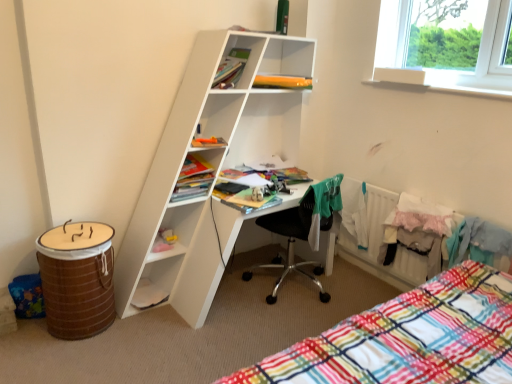
Question: Should I look upward or downward to see matte yellow book at center, which appears as the 2th book when ordered from the bottom?

Choices:
 (A) down
 (B) up

Answer: (B)

Question: Is orange plastic bag at upper center, which ranks as the 4th book in bottom-to-top order, oriented towards brown woven barrel at lower left?

Choices:
 (A) no
 (B) yes

Answer: (A)

Question: Is orange plastic bag at upper center, which ranks as the 4th book in bottom-to-top order, closer to the viewer compared to brown woven barrel at lower left?

Choices:
 (A) yes
 (B) no

Answer: (B)

Question: From a real-world perspective, does orange plastic bag at upper center, which ranks as the 4th book in bottom-to-top order, stand above brown woven barrel at lower left?

Choices:
 (A) yes
 (B) no

Answer: (A)

Question: Does orange plastic bag at upper center, arranged as the second book when viewed from the top, have a lesser height compared to brown woven barrel at lower left?

Choices:
 (A) yes
 (B) no

Answer: (A)

Question: Is orange plastic bag at upper center, arranged as the second book when viewed from the top, at the right side of brown woven barrel at lower left?

Choices:
 (A) no
 (B) yes

Answer: (B)

Question: Is orange plastic bag at upper center, arranged as the second book when viewed from the top, not within brown woven barrel at lower left?

Choices:
 (A) yes
 (B) no

Answer: (A)

Question: Can you confirm if white matte desk at center is thinner than matte yellow book at center, arranged as the fourth book when viewed from the top?

Choices:
 (A) no
 (B) yes

Answer: (A)

Question: Is white matte desk at center to the right of matte yellow book at center, arranged as the fourth book when viewed from the top, from the viewer's perspective?

Choices:
 (A) no
 (B) yes

Answer: (B)

Question: Is white matte desk at center oriented away from matte yellow book at center, which appears as the 2th book when ordered from the bottom?

Choices:
 (A) no
 (B) yes

Answer: (B)

Question: Is white matte desk at center to the left of matte yellow book at center, arranged as the fourth book when viewed from the top, from the viewer's perspective?

Choices:
 (A) yes
 (B) no

Answer: (B)

Question: Can you confirm if white matte desk at center is bigger than matte yellow book at center, which appears as the 2th book when ordered from the bottom?

Choices:
 (A) no
 (B) yes

Answer: (B)

Question: Is matte yellow book at center, arranged as the fourth book when viewed from the top, completely or partially inside white matte desk at center?

Choices:
 (A) yes
 (B) no

Answer: (A)

Question: Is white plastic radiator at lower right shorter than matte green book at upper center, which is the 1th book from top to bottom?

Choices:
 (A) yes
 (B) no

Answer: (B)